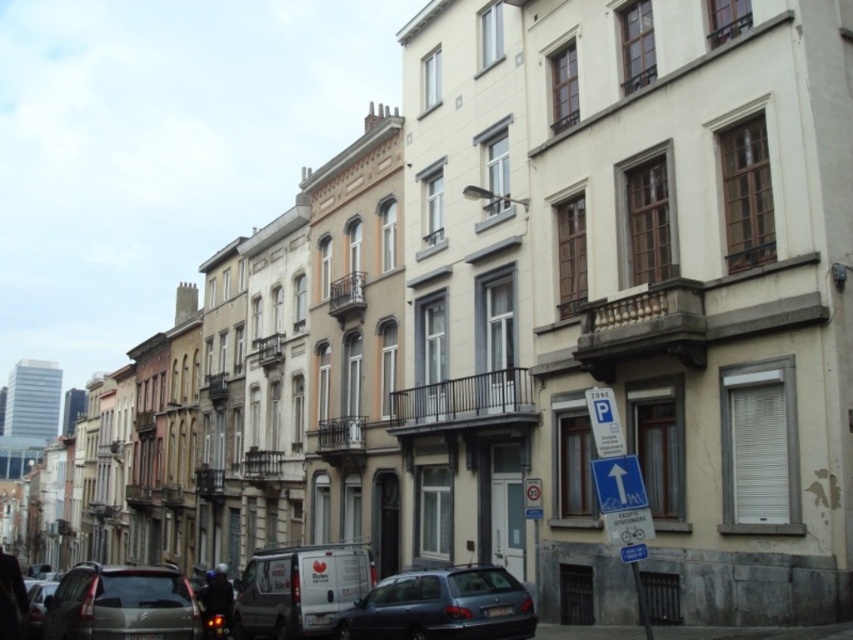
Question: Which of the following is the farthest from the observer?

Choices:
 (A) (108, 609)
 (B) (619, 483)

Answer: (A)

Question: Which point appears closest to the camera in this image?

Choices:
 (A) (32, 625)
 (B) (608, 474)

Answer: (B)

Question: Among these points, which one is nearest to the camera?

Choices:
 (A) (38, 632)
 (B) (627, 472)
 (C) (198, 621)
 (D) (529, 600)

Answer: (B)

Question: Where is metallic gray hatchback at lower center located in relation to shiny silver car at lower left in the image?

Choices:
 (A) below
 (B) above

Answer: (B)

Question: Where is metallic gray hatchback at lower center located in relation to shiny silver car at lower left in the image?

Choices:
 (A) right
 (B) left

Answer: (A)

Question: Where is metallic gray hatchback at lower center located in relation to blue plastic parking sign at lower right in the image?

Choices:
 (A) left
 (B) right

Answer: (A)